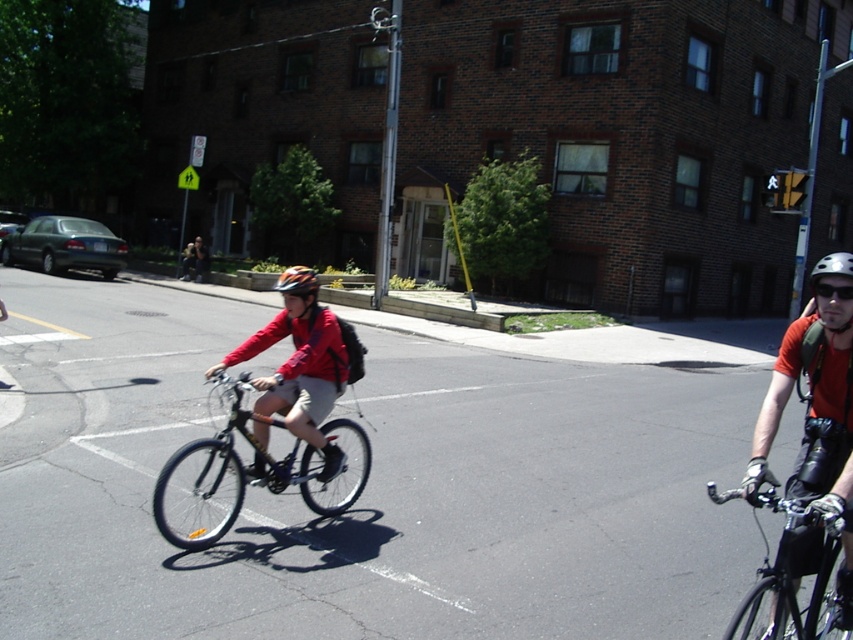
Between silver metallic bicycle at center and matte red jacket at center, which one appears on the left side from the viewer's perspective?

Positioned to the left is matte red jacket at center.

Who is more forward, (238, 387) or (202, 253)?

Point (238, 387)

Find the location of a particular element. Image resolution: width=853 pixels, height=640 pixels. silver metallic bicycle at center is located at coordinates (236, 476).

Describe the element at coordinates (791, 573) in the screenshot. The height and width of the screenshot is (640, 853). I see `shiny black bicycle at right` at that location.

Does point (805, 524) come farther from viewer compared to point (833, 253)?

No, it is not.

This screenshot has height=640, width=853. In order to click on shiny black bicycle at right in this screenshot , I will do `click(791, 573)`.

How distant is silver metallic bicycle at center from shiny black bicycle at right?

silver metallic bicycle at center is 3.40 meters from shiny black bicycle at right.

Measure the distance between silver metallic bicycle at center and camera.

silver metallic bicycle at center is 14.92 feet away from camera.

Which is behind, point (177, 500) or point (776, 628)?

Positioned behind is point (177, 500).

Where is `silver metallic bicycle at center`? silver metallic bicycle at center is located at coordinates (236, 476).